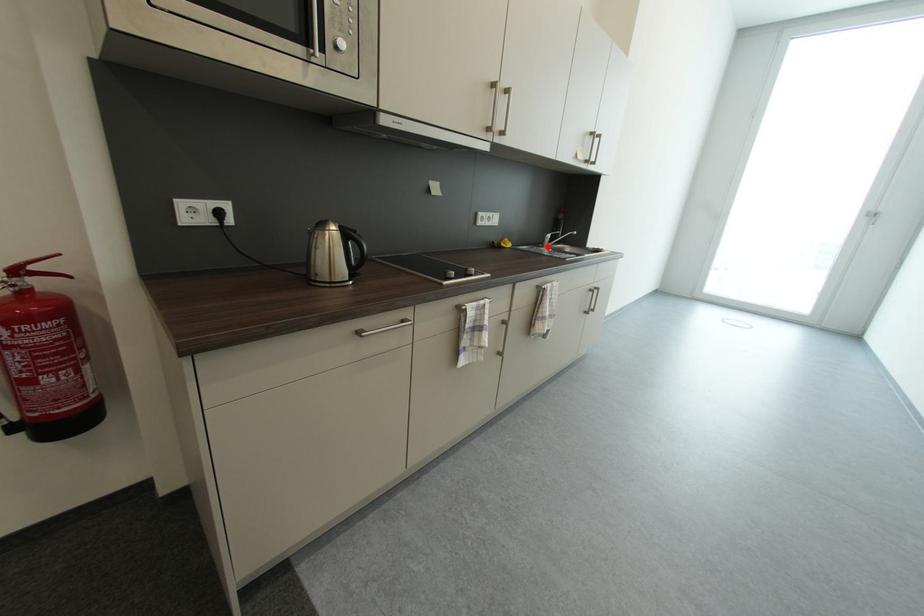
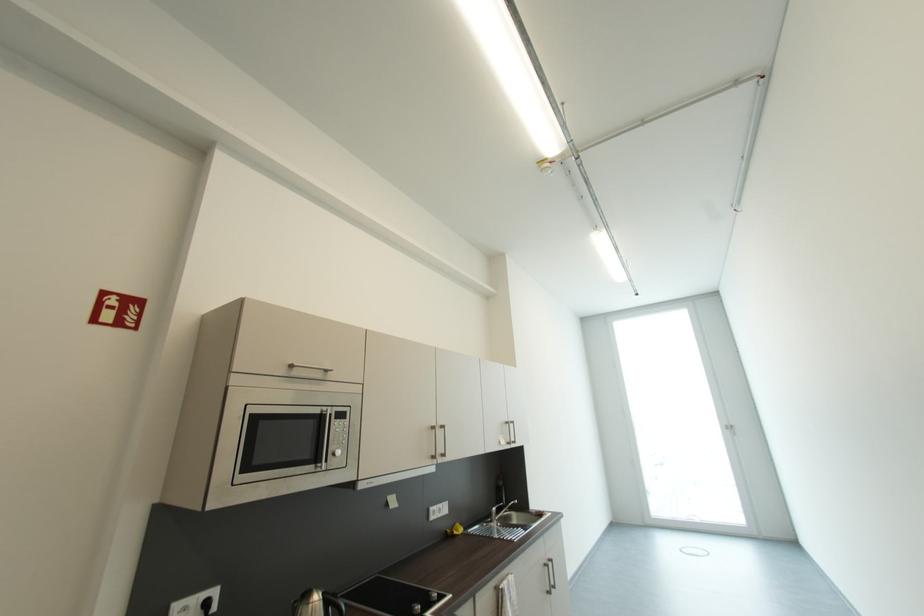
Question: I am providing you with two images of the same scene from different viewpoints. A red point is marked on the first image. Is the red point's position out of view in image 2?

Choices:
 (A) Yes
 (B) No

Answer: (B)